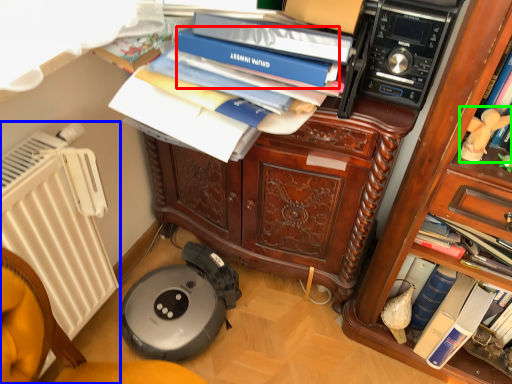
Question: Which object is the farthest from paperback book (highlighted by a red box)? Choose among these: radiator (highlighted by a blue box) or person (highlighted by a green box).

Choices:
 (A) radiator
 (B) person

Answer: (A)